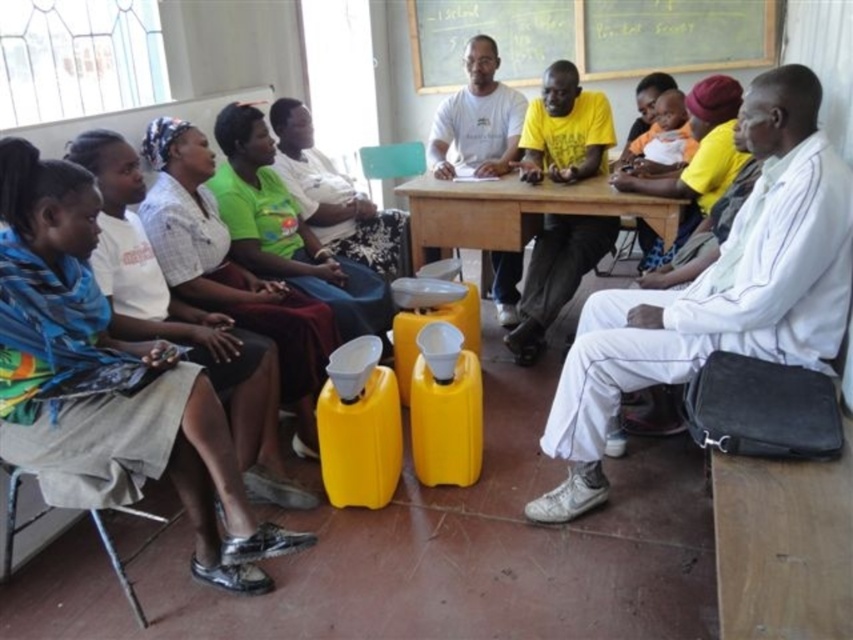
Based on the photo, you are a delivery person standing at the entrance of the room. You need to place a package on the matte blue scarf at left. Can you reach it from your current position?

The matte blue scarf at left is 1.78 meters away from you, so yes, you can reach it from your current position as the distance is manageable for placing the package.

You are standing in the room and want to walk towards the two points marked in the image. Which point, point (108,365) or point (634,198), will you reach first?

Point (108,365) is closer to the viewer than point (634,198), so you will reach point (108,365) first.